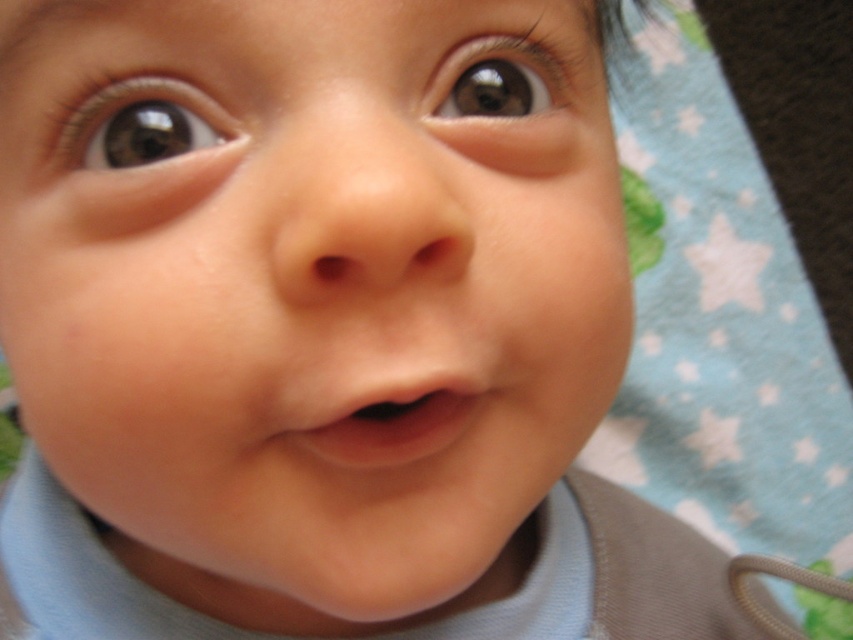
Measure the distance between smooth skin baby face at center and camera.

A distance of 6.81 inches exists between smooth skin baby face at center and camera.

Does smooth skin baby face at center appear under brown glossy eye at upper left?

Yes.

Is point (328, 32) farther from camera compared to point (114, 99)?

No, (328, 32) is closer to viewer.

Find the location of `smooth skin baby face at center`. smooth skin baby face at center is located at coordinates (306, 298).

Can you confirm if brown glossy eye at upper left is positioned to the left of pink smooth flesh at center?

Indeed, brown glossy eye at upper left is positioned on the left side of pink smooth flesh at center.

Can you confirm if brown glossy eye at upper left is bigger than pink smooth flesh at center?

Incorrect, brown glossy eye at upper left is not larger than pink smooth flesh at center.

Measure the distance between brown glossy eye at upper left and camera.

brown glossy eye at upper left is 8.17 inches away from camera.

Locate an element on the screen. This screenshot has height=640, width=853. brown glossy eye at upper left is located at coordinates (142, 125).

In the scene shown: Who is more distant from viewer, [109,355] or [380,429]?

The point [380,429] is behind.

What do you see at coordinates (306, 298) in the screenshot? I see `smooth skin baby face at center` at bounding box center [306, 298].

Image resolution: width=853 pixels, height=640 pixels. Describe the element at coordinates (306, 298) in the screenshot. I see `smooth skin baby face at center` at that location.

The image size is (853, 640). Identify the location of smooth skin baby face at center. (306, 298).